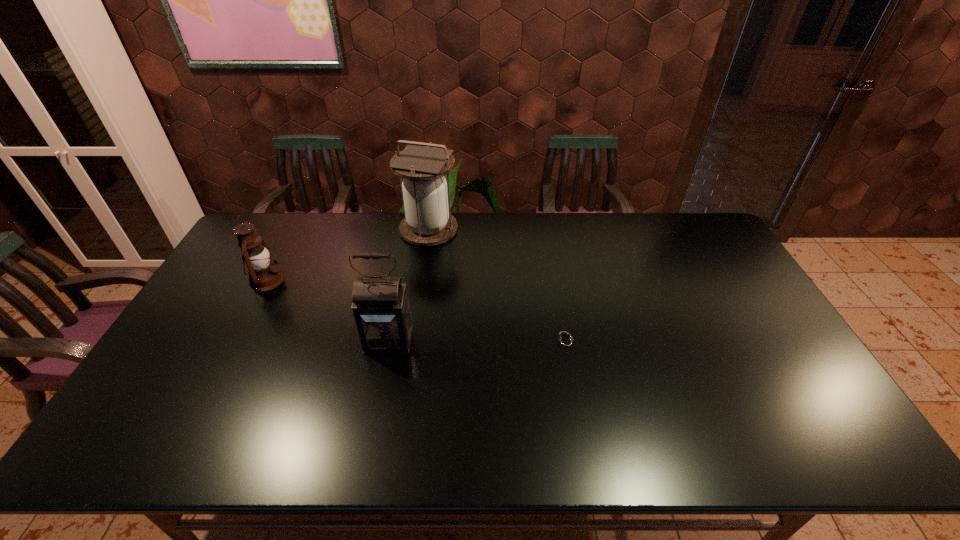
Find the location of `the farthest object`. the farthest object is located at coordinates (428, 222).

You are a GUI agent. You are given a task and a screenshot of the screen. Output one action in this format:
    pyautogui.click(x=<x>, y=<y>)
    Task: Click on the nearest lantern
    This screenshot has width=960, height=540.
    Given the screenshot: What is the action you would take?
    pyautogui.click(x=381, y=309)

Identify the location of the second farthest object. The width and height of the screenshot is (960, 540). (263, 275).

I want to click on the shortest lantern, so [263, 275].

Locate an element on the screen. Image resolution: width=960 pixels, height=540 pixels. the rightmost object is located at coordinates (564, 342).

In order to click on watch in this screenshot , I will do `click(564, 342)`.

At what (x,y) coordinates should I click in order to perform the action: click on free location located on the right of the farthest lantern. Please return your answer as a coordinate pair (x, y). The image size is (960, 540). Looking at the image, I should click on (506, 229).

Find the location of a particular element. The image size is (960, 540). blank area located 0.080m on the front-facing side of the nearest lantern is located at coordinates (381, 382).

The height and width of the screenshot is (540, 960). Find the location of `vacant region located on the side of the third tallest object, there is a wick adjustment knob`. vacant region located on the side of the third tallest object, there is a wick adjustment knob is located at coordinates pos(346,280).

At what (x,y) coordinates should I click in order to perform the action: click on free space located 0.360m on the face of the shortest object. Please return your answer as a coordinate pair (x, y). Looking at the image, I should click on (x=420, y=342).